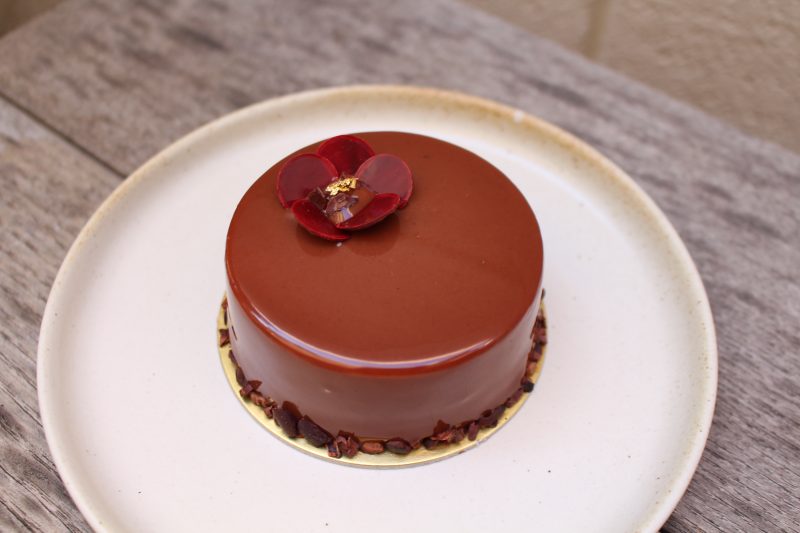
Where is `wooden table top`? This screenshot has width=800, height=533. wooden table top is located at coordinates (178, 106).